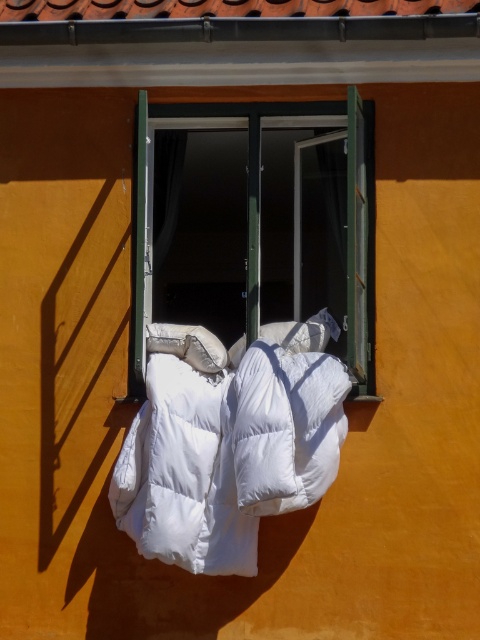
You are standing in front of the orange wall with the open window and the white puffer jacket. There are two points marked on the wall at coordinates point (330, 177) and point (274, 360). Which point is closer to you?

Point (330, 177) is further to the camera than point (274, 360), so point (274, 360) is closer to you.

You are standing in front of the orange wall and see the point marked at coordinates (x=183, y=474). What object is located at that point?

The point at (x=183, y=474) indicates the white down filled blanket at center.